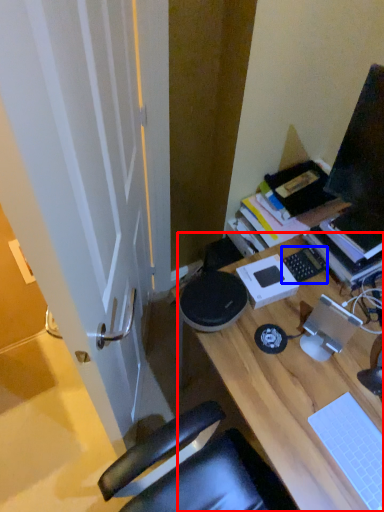
Question: Which of the following is the farthest to the observer, desk (highlighted by a red box) or laptop keyboard (highlighted by a blue box)?

Choices:
 (A) desk
 (B) laptop keyboard

Answer: (B)